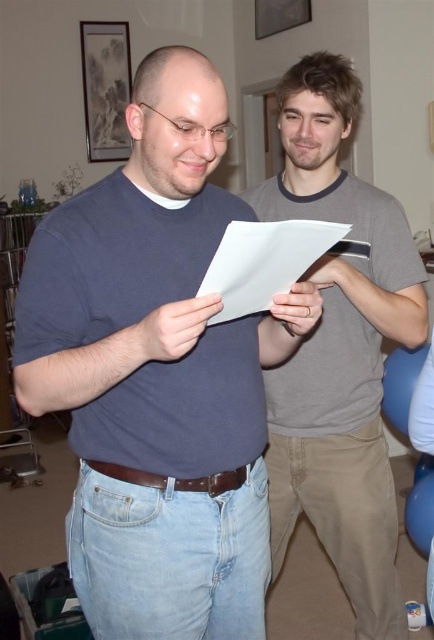
Question: From the image, what is the correct spatial relationship of gray cotton t-shirt at center in relation to white paper at center?

Choices:
 (A) below
 (B) above

Answer: (A)

Question: Among these objects, which one is nearest to the camera?

Choices:
 (A) white paper at center
 (B) gray cotton t-shirt at center
 (C) matte blue shirt at center

Answer: (A)

Question: Does gray cotton t-shirt at center have a lesser width compared to white paper at center?

Choices:
 (A) no
 (B) yes

Answer: (A)

Question: Which object is the closest to the matte blue shirt at center?

Choices:
 (A) white paper at center
 (B) gray cotton t-shirt at center

Answer: (A)

Question: Considering the relative positions of matte blue shirt at center and white paper at center in the image provided, where is matte blue shirt at center located with respect to white paper at center?

Choices:
 (A) right
 (B) left

Answer: (B)

Question: Which of these objects is positioned farthest from the gray cotton t-shirt at center?

Choices:
 (A) white paper at center
 (B) matte blue shirt at center

Answer: (B)